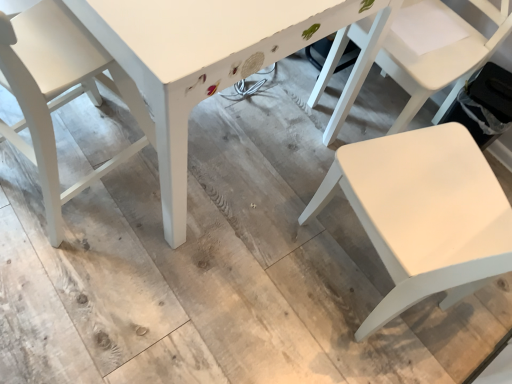
Question: Is white painted wood table at center bigger than white matte chair at right, the 3th chair in the left-to-right sequence?

Choices:
 (A) yes
 (B) no

Answer: (A)

Question: Can we say white painted wood table at center lies outside white matte chair at right, the 3th chair in the left-to-right sequence?

Choices:
 (A) yes
 (B) no

Answer: (A)

Question: Would you say white matte chair at right, the 3th chair in the left-to-right sequence, is part of white painted wood table at center's contents?

Choices:
 (A) no
 (B) yes

Answer: (A)

Question: From the image's perspective, is white painted wood table at center under white matte chair at right, the 3th chair in the left-to-right sequence?

Choices:
 (A) yes
 (B) no

Answer: (B)

Question: Is white painted wood table at center in contact with white matte chair at right, placed as the 1th chair when sorted from right to left?

Choices:
 (A) no
 (B) yes

Answer: (A)

Question: Considering the positions of point (439, 44) and point (403, 233), is point (439, 44) closer or farther from the camera than point (403, 233)?

Choices:
 (A) closer
 (B) farther

Answer: (B)

Question: In terms of height, does white matte chair at right, the 3th chair in the left-to-right sequence, look taller or shorter compared to white matte chair at lower right, which is the 2th chair from left to right?

Choices:
 (A) short
 (B) tall

Answer: (A)

Question: Is white matte chair at right, placed as the 1th chair when sorted from right to left, inside the boundaries of white matte chair at lower right, which is the 2th chair from left to right, or outside?

Choices:
 (A) outside
 (B) inside

Answer: (A)

Question: In terms of width, does white matte chair at right, the 3th chair in the left-to-right sequence, look wider or thinner when compared to white matte chair at lower right, which is the 2th chair from left to right?

Choices:
 (A) thin
 (B) wide

Answer: (A)

Question: Is white matte chair at lower right, the 2th chair viewed from the right, taller or shorter than white matte chair at left, which is counted as the 1th chair, starting from the left?

Choices:
 (A) short
 (B) tall

Answer: (B)

Question: From the image's perspective, is white matte chair at lower right, which is the 2th chair from left to right, above or below white matte chair at left, which is counted as the 1th chair, starting from the left?

Choices:
 (A) below
 (B) above

Answer: (A)

Question: Choose the correct answer: Is white matte chair at lower right, the 2th chair viewed from the right, inside white matte chair at left, which is counted as the 1th chair, starting from the left, or outside it?

Choices:
 (A) outside
 (B) inside

Answer: (A)

Question: Relative to white matte chair at left, acting as the third chair starting from the right, is white matte chair at lower right, the 2th chair viewed from the right, in front or behind?

Choices:
 (A) behind
 (B) front

Answer: (B)

Question: In terms of size, does white painted wood table at center appear bigger or smaller than white matte chair at lower right, which is the 2th chair from left to right?

Choices:
 (A) big
 (B) small

Answer: (A)

Question: From the image's perspective, is white painted wood table at center positioned above or below white matte chair at lower right, which is the 2th chair from left to right?

Choices:
 (A) above
 (B) below

Answer: (A)